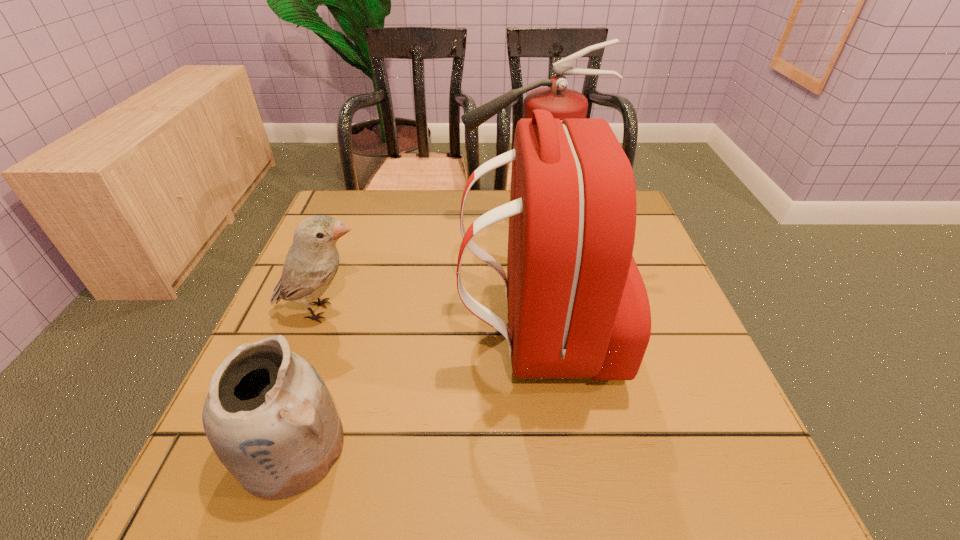
Locate an element on the screen. the farthest object is located at coordinates (563, 103).

Identify the location of backpack. 578,307.

You are a GUI agent. You are given a task and a screenshot of the screen. Output one action in this format:
    pyautogui.click(x=<x>, y=<y>)
    Task: Click on the bird
    
    Given the screenshot: What is the action you would take?
    pyautogui.click(x=312, y=261)

Identify the location of pottery. The image size is (960, 540). (269, 417).

This screenshot has width=960, height=540. I want to click on free location located at the nozzle of the fire extinguisher, so click(421, 222).

Where is `free space located at the nozzle of the fire extinguisher`? free space located at the nozzle of the fire extinguisher is located at coordinates (429, 222).

I want to click on vacant point located 0.330m at the nozzle of the fire extinguisher, so click(x=336, y=222).

This screenshot has width=960, height=540. Identify the location of vacant position located 0.240m on the strap side of the backpack. (337, 334).

Where is `free space located 0.090m on the strap side of the backpack`? free space located 0.090m on the strap side of the backpack is located at coordinates (415, 334).

Locate an element on the screen. blank area located on the strap side of the backpack is located at coordinates (363, 334).